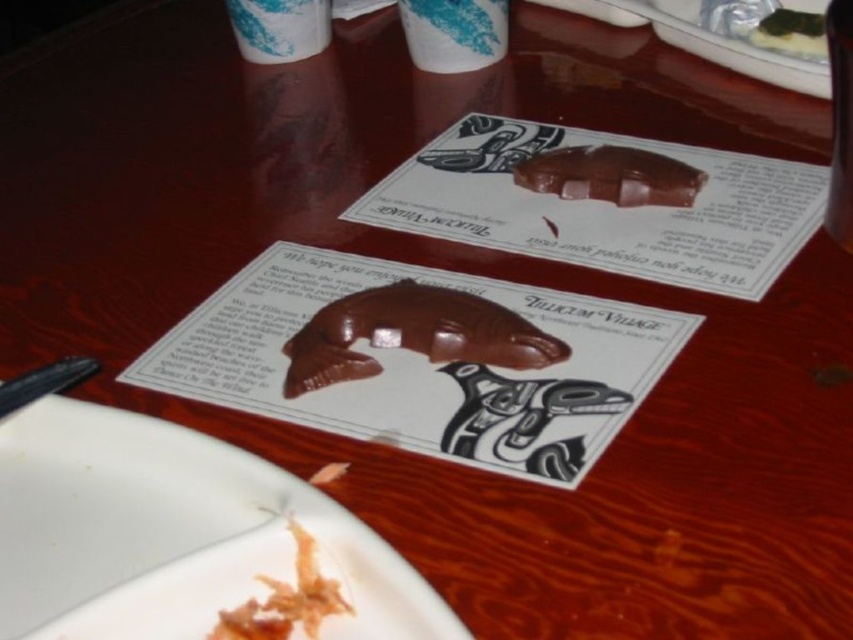
Based on the photo, can you confirm if matte brown chocolate at center is wider than shiny silver platter at upper right?

No.

Who is shorter, matte brown chocolate at center or shiny silver platter at upper right?

matte brown chocolate at center is shorter.

Find the location of a particular element. The height and width of the screenshot is (640, 853). matte brown chocolate at center is located at coordinates (410, 333).

Which of these two, white matte plate at lower left or shiny brown chocolate at upper center, stands taller?

white matte plate at lower left is taller.

Does white matte plate at lower left appear over shiny brown chocolate at upper center?

Actually, white matte plate at lower left is below shiny brown chocolate at upper center.

Is point (148, 451) in front of point (572, 164)?

Yes.

I want to click on white matte plate at lower left, so click(x=173, y=534).

Does white matte plate at lower left appear over matte brown chocolate at center?

No, white matte plate at lower left is not above matte brown chocolate at center.

Is the position of white matte plate at lower left more distant than that of matte brown chocolate at center?

No, it is not.

Does point (169, 433) lie in front of point (469, 353)?

Yes.

Identify the location of white matte plate at lower left. pyautogui.click(x=173, y=534).